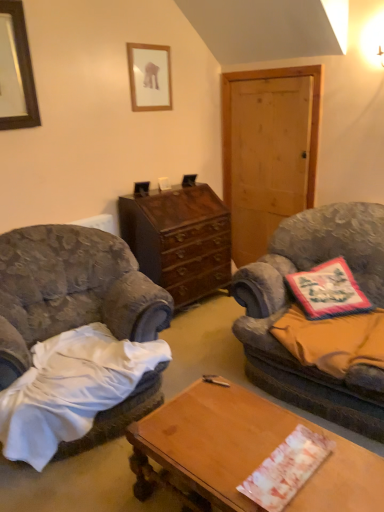
Question: Relative to velvet gray armchair at left, is floral fabric pillow at right in front or behind?

Choices:
 (A) front
 (B) behind

Answer: (B)

Question: In terms of height, does floral fabric pillow at right look taller or shorter compared to velvet gray armchair at left?

Choices:
 (A) short
 (B) tall

Answer: (A)

Question: Which is farther from the white paper at center, the 2th sheet from the top?

Choices:
 (A) velvet fabric couch at right
 (B) black wooden picture frame at upper left, the first picture frame positioned from the front
 (C) dark brown wood cabinet at center
 (D) velvet gray armchair at left
 (E) orange fabric pillow at right, placed as the second sheet when sorted from bottom to top

Answer: (B)

Question: Which object is the farthest from the velvet gray armchair at left?

Choices:
 (A) white paper at center, the 2th sheet from the top
 (B) orange fabric pillow at right, the first sheet positioned from the back
 (C) wooden framed picture at upper center, which is the 2th picture frame from front to back
 (D) black wooden picture frame at upper left, which is the second picture frame in back-to-front order
 (E) dark brown wood cabinet at center

Answer: (C)